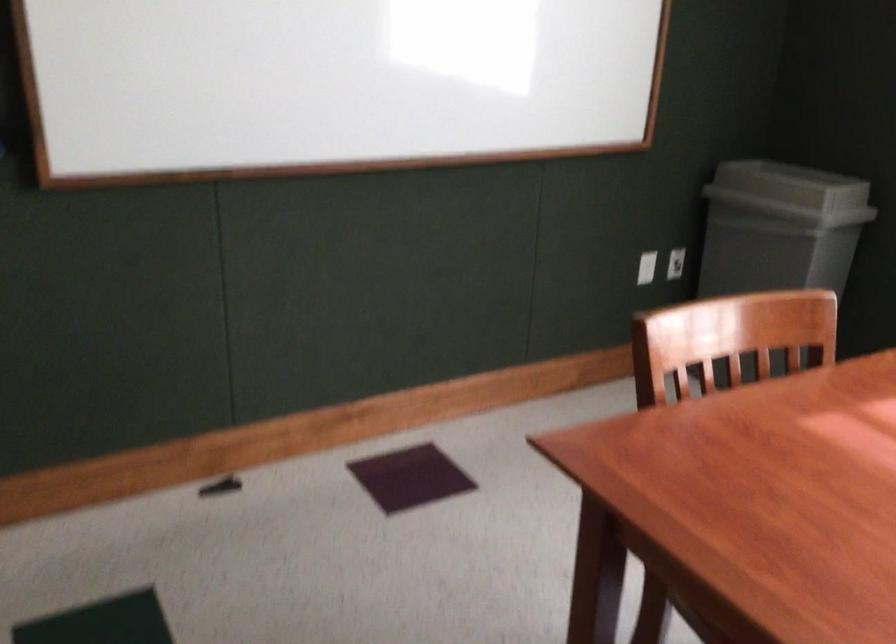
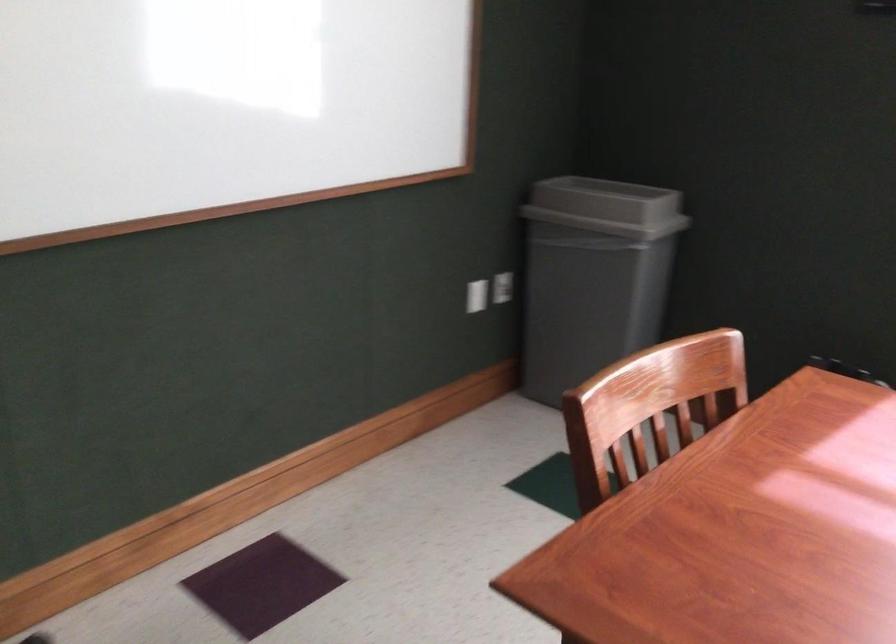
The point at (x=650, y=263) is marked in the first image. Where is the corresponding point in the second image?

(477, 295)